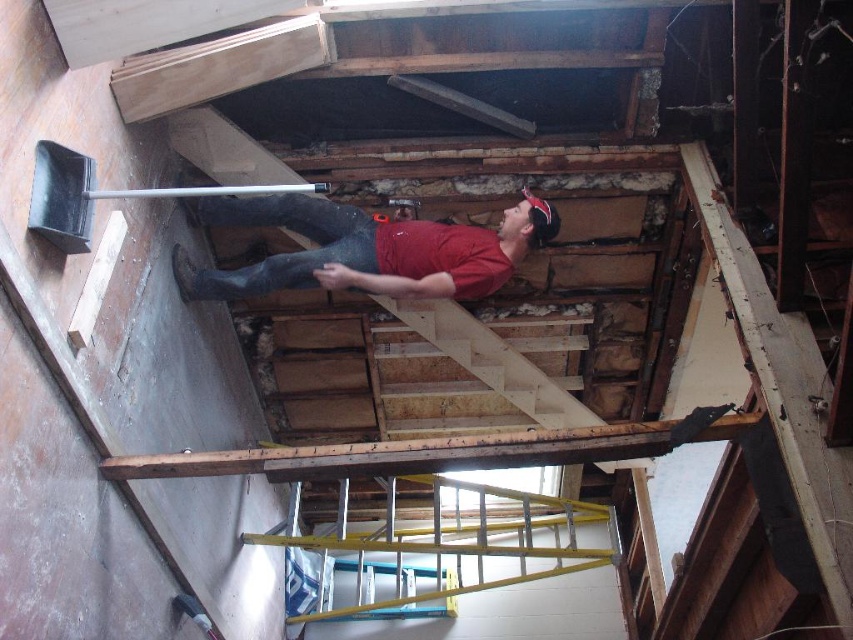
Question: Which point appears farthest from the camera in this image?

Choices:
 (A) (354, 288)
 (B) (347, 609)

Answer: (B)

Question: Which is farther from the yellow metallic ladder at center?

Choices:
 (A) matte red shirt at upper center
 (B) black plastic shovel at left

Answer: (B)

Question: Considering the relative positions of yellow metallic ladder at center and black plastic shovel at left in the image provided, where is yellow metallic ladder at center located with respect to black plastic shovel at left?

Choices:
 (A) above
 (B) below

Answer: (B)

Question: From the image, what is the correct spatial relationship of matte red shirt at upper center in relation to black plastic shovel at left?

Choices:
 (A) above
 (B) below

Answer: (B)

Question: Is yellow metallic ladder at center positioned in front of matte red shirt at upper center?

Choices:
 (A) no
 (B) yes

Answer: (A)

Question: Which object is the farthest from the yellow metallic ladder at center?

Choices:
 (A) black plastic shovel at left
 (B) matte red shirt at upper center

Answer: (A)